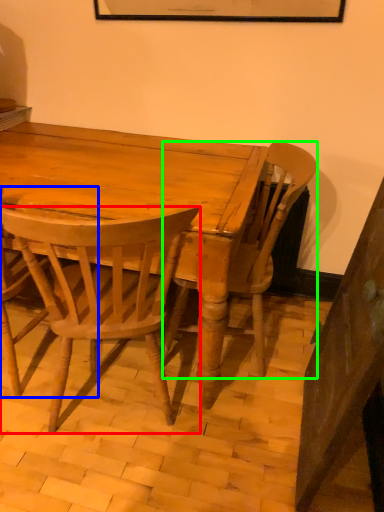
Question: Estimate the real-world distances between objects in this image. Which object is closer to chair (highlighted by a red box), chair (highlighted by a blue box) or chair (highlighted by a green box)?

Choices:
 (A) chair
 (B) chair

Answer: (A)